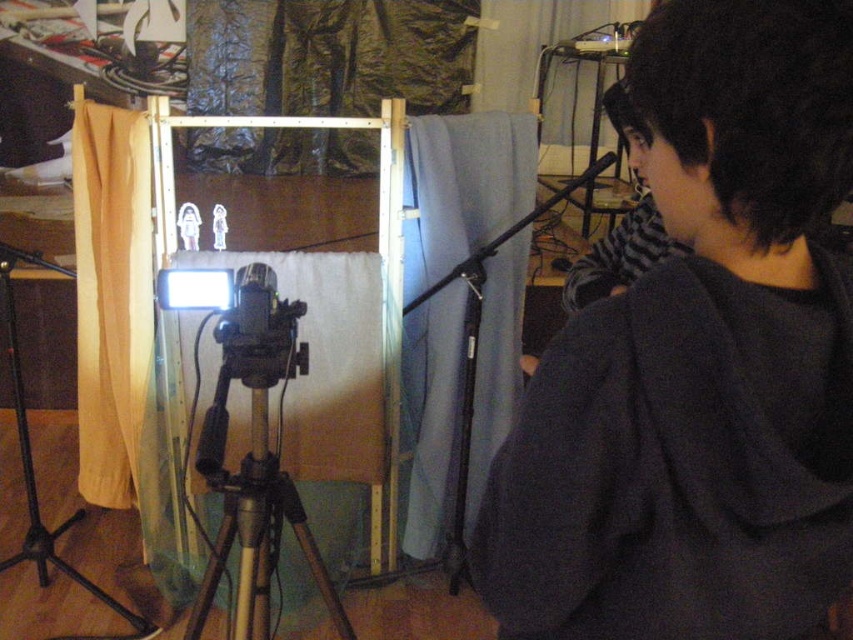
Question: Can you confirm if dark gray hoodie at upper right is smaller than wooden tripod at center?

Choices:
 (A) yes
 (B) no

Answer: (A)

Question: Among these points, which one is nearest to the camera?

Choices:
 (A) (258, 397)
 (B) (799, 424)
 (C) (33, 541)
 (D) (236, 364)

Answer: (B)

Question: Is satin black camera at center to the left of black matte tripod at lower left from the viewer's perspective?

Choices:
 (A) yes
 (B) no

Answer: (B)

Question: Which point appears closest to the camera in this image?

Choices:
 (A) (245, 586)
 (B) (751, 349)
 (C) (285, 364)

Answer: (B)

Question: Which point is farther to the camera?

Choices:
 (A) black matte tripod at lower left
 (B) wooden tripod at center
 (C) dark gray hoodie at upper right

Answer: (A)

Question: Does dark gray hoodie at upper right lie behind satin black camera at center?

Choices:
 (A) no
 (B) yes

Answer: (A)